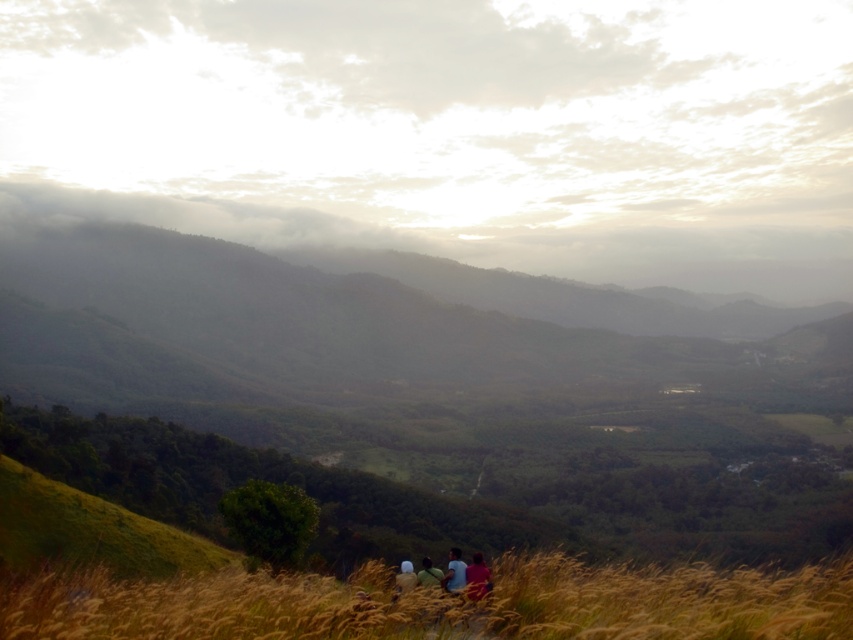
Is point (769, 141) less distant than point (434, 566)?

No, it is not.

Between cloudy sky at upper center and matte black shirt at lower center, which one has less height?

With less height is matte black shirt at lower center.

This screenshot has width=853, height=640. I want to click on cloudy sky at upper center, so click(x=445, y=122).

Does golden dry grass at lower center appear under blue fabric person at lower center?

No.

Who is more distant from viewer, [120,611] or [407,576]?

The point [407,576] is more distant.

Locate an element on the screen. The height and width of the screenshot is (640, 853). golden dry grass at lower center is located at coordinates (442, 604).

Who is positioned more to the right, cloudy sky at upper center or matte pink shirt at lower center?

From the viewer's perspective, matte pink shirt at lower center appears more on the right side.

Is cloudy sky at upper center smaller than matte pink shirt at lower center?

Actually, cloudy sky at upper center might be larger than matte pink shirt at lower center.

Between point (689, 28) and point (488, 584), which one is positioned in front?

Point (488, 584) is more forward.

This screenshot has height=640, width=853. I want to click on cloudy sky at upper center, so click(x=445, y=122).